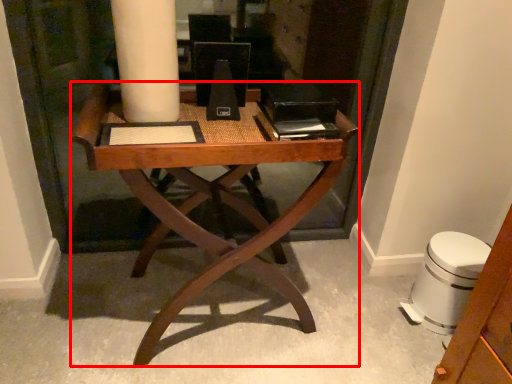
Question: Where is desk (annotated by the red box) located in relation to swivel chair in the image?

Choices:
 (A) left
 (B) right

Answer: (A)